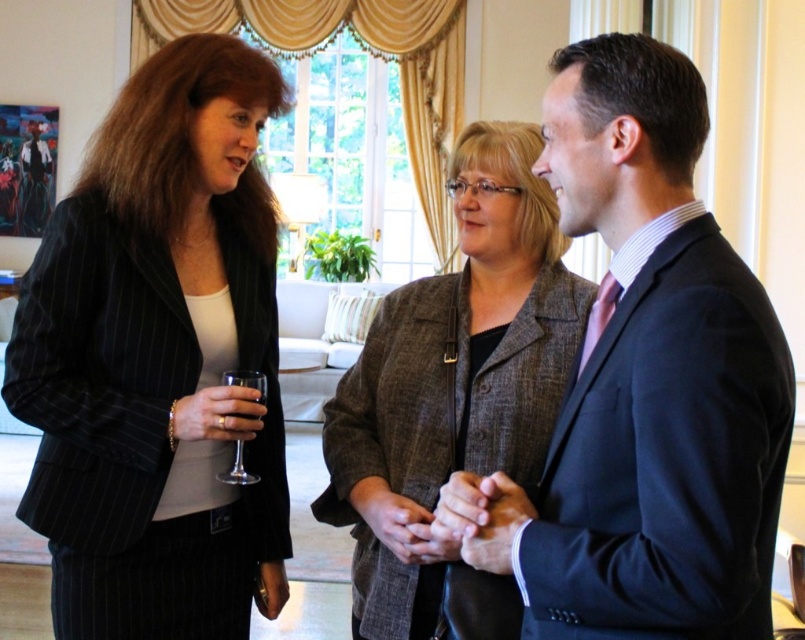
This screenshot has height=640, width=805. What do you see at coordinates (159, 358) in the screenshot? I see `matte black blazer at left` at bounding box center [159, 358].

Between matte black blazer at left and matte black suit at center, which one appears on the right side from the viewer's perspective?

From the viewer's perspective, matte black suit at center appears more on the right side.

Is point (48, 545) positioned in front of point (673, 372)?

No, it is not.

Image resolution: width=805 pixels, height=640 pixels. I want to click on matte black blazer at left, so pyautogui.click(x=159, y=358).

Does brown textured blazer at center have a smaller size compared to clear glass wine glass at left?

No.

Is brown textured blazer at center above clear glass wine glass at left?

Yes, brown textured blazer at center is above clear glass wine glass at left.

Is point (382, 356) positioned behind point (240, 464)?

Yes, point (382, 356) is behind point (240, 464).

Locate an element on the screen. The width and height of the screenshot is (805, 640). brown textured blazer at center is located at coordinates (452, 381).

Which of these two, matte black blazer at left or clear glass wine glass at left, stands shorter?

A: clear glass wine glass at left is shorter.

Does matte black blazer at left appear under clear glass wine glass at left?

No, matte black blazer at left is not below clear glass wine glass at left.

Identify the location of matte black blazer at left. (159, 358).